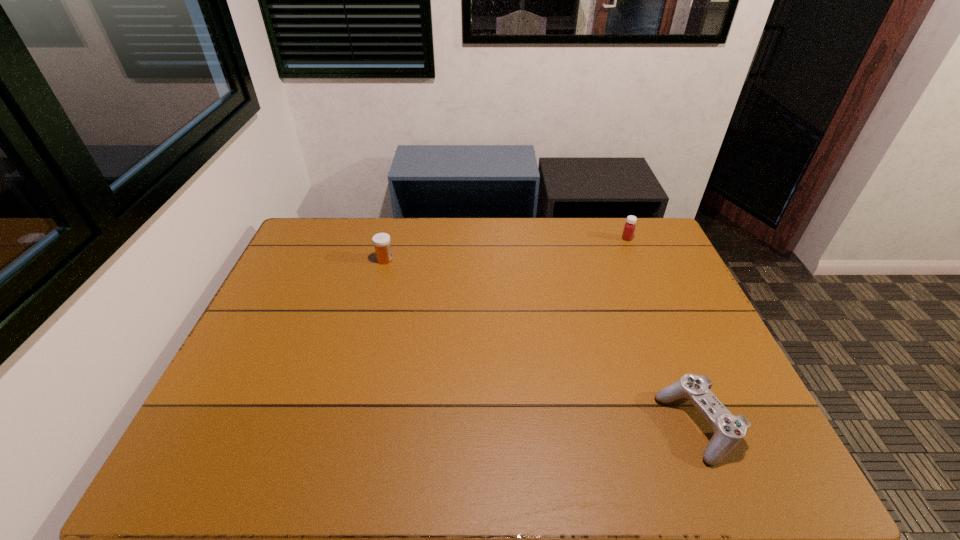
Where is `medicine that is at the right edge`? medicine that is at the right edge is located at coordinates (629, 227).

This screenshot has width=960, height=540. Identify the location of control located at the right edge. (729, 430).

I want to click on object at the far right corner, so click(629, 227).

The height and width of the screenshot is (540, 960). Identify the location of object present at the near right corner. (729, 430).

This screenshot has height=540, width=960. Identify the location of free location at the far edge of the desktop. [x=475, y=219].

In the image, there is a desktop. Where is `free space at the near edge`? The image size is (960, 540). free space at the near edge is located at coordinates (319, 470).

The height and width of the screenshot is (540, 960). Identify the location of free space at the left edge of the desktop. (201, 440).

Find the location of a particular element. The height and width of the screenshot is (540, 960). vacant area at the right edge of the desktop is located at coordinates (670, 262).

Identify the location of vacant space that's between the second farthest object and the shortest object. (541, 343).

The height and width of the screenshot is (540, 960). In order to click on vacant region between the leftmost object and the nearest object in this screenshot , I will do `click(541, 343)`.